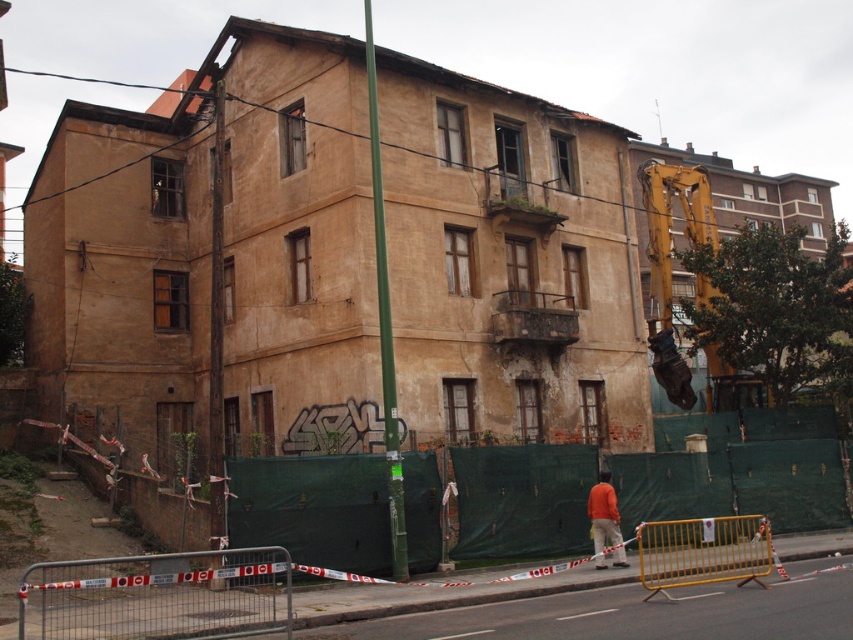
You are a delivery person trying to see the building under renovation. You notice the green metallic pole at center and the orange fabric construction worker at lower center. Which object is taller?

The green metallic pole at center is taller than the orange fabric construction worker at lower center.

You are a delivery person with a cart that is 8 meters wide. You need to move from the green metallic pole at center to the orange fabric construction worker at lower center. Can your cart fit through the space between them?

The distance between the green metallic pole at center and the orange fabric construction worker at lower center is 7.12 meters. Since your cart is 8 meters wide, it cannot fit through the space between them.